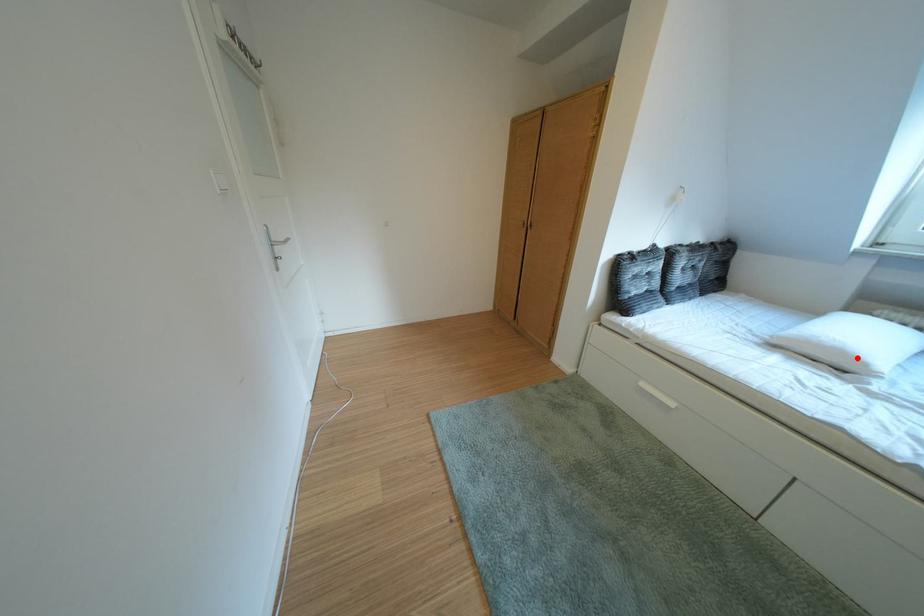
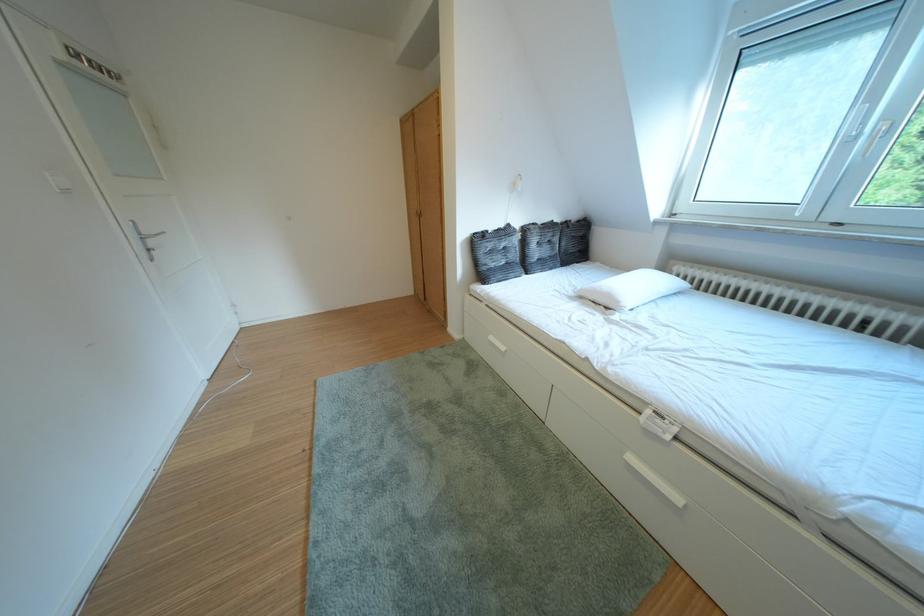
Find the pixel in the second image that matches the highlighted location in the first image.

(623, 301)